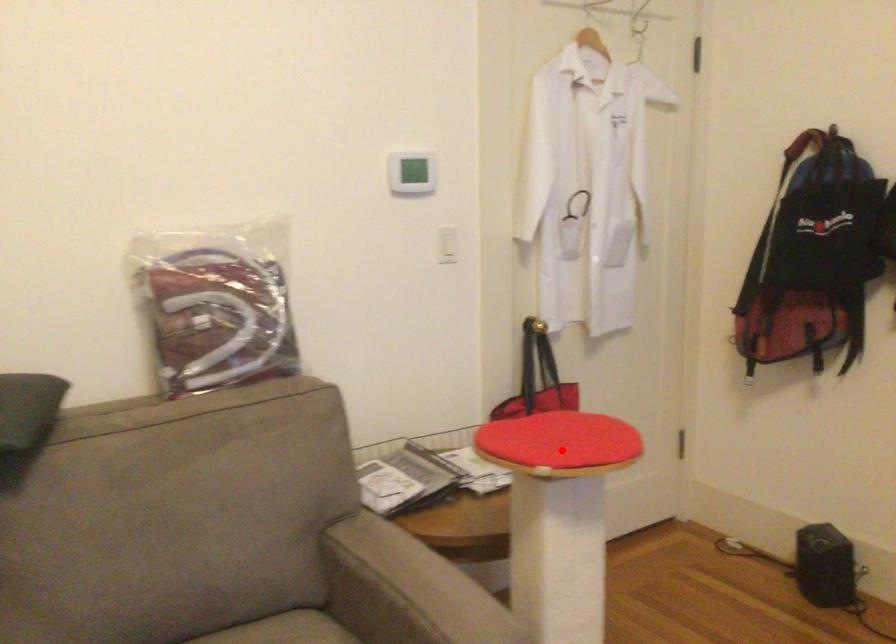
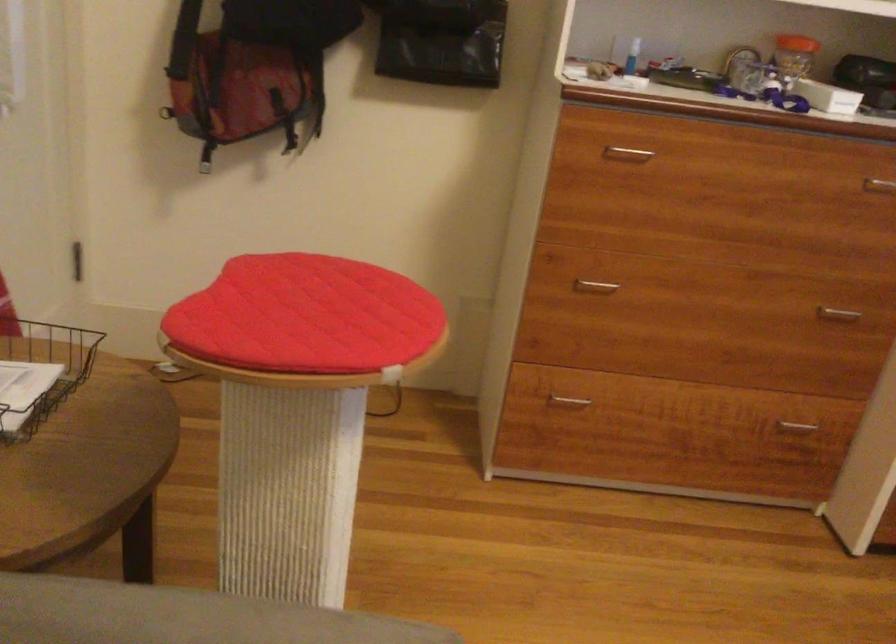
Locate, in the second image, the point that corresponds to the highlighted location in the first image.

(306, 316)